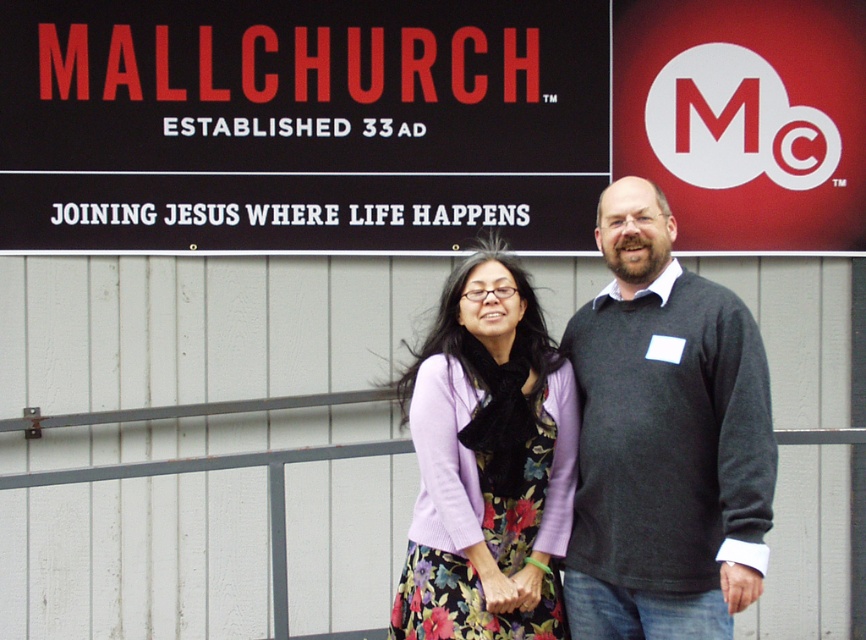
You are a photographer trying to capture a photo of the black sign at upper center and the dark gray sweater at center. The camera you have can only focus on objects within a 1.5 meter range. Will both objects be in focus if you position the camera exactly halfway between them?

The black sign at upper center and dark gray sweater at center are 1.80 meters apart from each other. If the camera is placed halfway between them, the distance from the camera to each object would be 0.90 meters. Since the camera can focus within a 1.5 meter range, both objects will be within the focus range and thus in focus.

You are a photographer trying to capture the black sign at upper center and the dark gray sweater at center in the same frame. Based on their sizes, which object do you think will appear larger in the photo?

The black sign at upper center might be wider than dark gray sweater at center, so it will likely appear larger in the photo.

Based on the photo, what are the coordinates of the dark gray sweater at center?

The dark gray sweater at center is located at point [664,440].